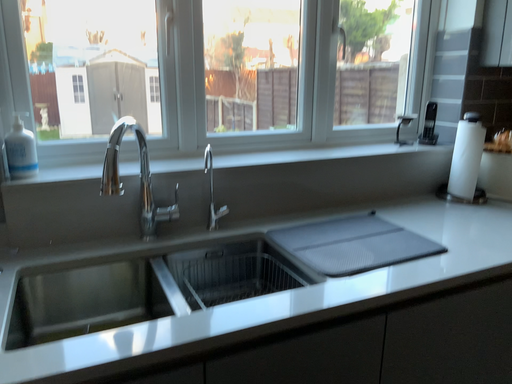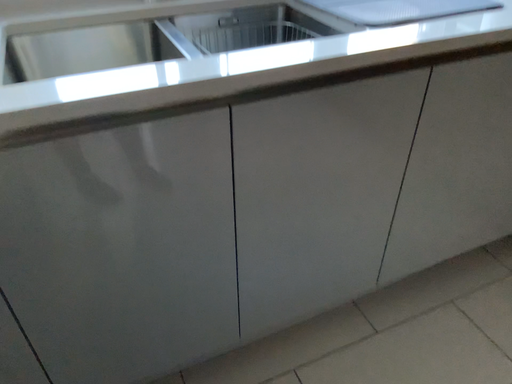
Question: How did the camera likely rotate when shooting the video?

Choices:
 (A) rotated downward
 (B) rotated upward

Answer: (A)